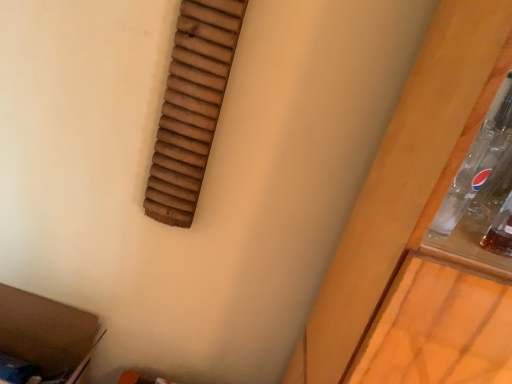
Where is `wooden slats at upper left`? This screenshot has height=384, width=512. wooden slats at upper left is located at coordinates (191, 106).

What do you see at coordinates (191, 106) in the screenshot?
I see `wooden slats at upper left` at bounding box center [191, 106].

Identify the location of brown cardboard at lower left. (46, 332).

The width and height of the screenshot is (512, 384). Describe the element at coordinates (46, 332) in the screenshot. I see `brown cardboard at lower left` at that location.

Where is `wooden slats at upper left`? wooden slats at upper left is located at coordinates (191, 106).

Considering the relative positions of wooden slats at upper left and brown cardboard at lower left in the image provided, is wooden slats at upper left to the right of brown cardboard at lower left from the viewer's perspective?

Correct, you'll find wooden slats at upper left to the right of brown cardboard at lower left.

Which object is more forward, wooden slats at upper left or brown cardboard at lower left?

wooden slats at upper left.

Is point (189, 213) farther from viewer compared to point (65, 323)?

No, it is in front of (65, 323).

From the image's perspective, which one is positioned lower, wooden slats at upper left or brown cardboard at lower left?

brown cardboard at lower left.

From a real-world perspective, which object stands above the other?

From a 3D spatial view, wooden slats at upper left is above.

Considering the sizes of objects wooden slats at upper left and brown cardboard at lower left in the image provided, who is thinner, wooden slats at upper left or brown cardboard at lower left?

With smaller width is wooden slats at upper left.

In terms of height, does wooden slats at upper left look taller or shorter compared to brown cardboard at lower left?

wooden slats at upper left is taller than brown cardboard at lower left.

Which of these two, wooden slats at upper left or brown cardboard at lower left, is bigger?

brown cardboard at lower left.

Choose the correct answer: Is wooden slats at upper left inside brown cardboard at lower left or outside it?

wooden slats at upper left cannot be found inside brown cardboard at lower left.

Is wooden slats at upper left in contact with brown cardboard at lower left?

There is a gap between wooden slats at upper left and brown cardboard at lower left.

Is wooden slats at upper left oriented towards brown cardboard at lower left?

No, wooden slats at upper left is not turned towards brown cardboard at lower left.

How many degrees apart are the facing directions of wooden slats at upper left and brown cardboard at lower left?

The facing directions of wooden slats at upper left and brown cardboard at lower left are 3.9 degrees apart.

Measure the distance from wooden slats at upper left to brown cardboard at lower left.

wooden slats at upper left and brown cardboard at lower left are 24.79 inches apart.

This screenshot has width=512, height=384. Find the location of `window that is above the brown cardboard at lower left (from a real-world perspective)`. window that is above the brown cardboard at lower left (from a real-world perspective) is located at coordinates click(191, 106).

In the image, is brown cardboard at lower left on the left side or the right side of wooden slats at upper left?

brown cardboard at lower left is to the left of wooden slats at upper left.

Considering their positions, is brown cardboard at lower left located in front of or behind wooden slats at upper left?

brown cardboard at lower left is behind wooden slats at upper left.

Which is less distant, (44, 337) or (186, 172)?

Point (44, 337) is farther from the camera than point (186, 172).

In the scene shown: From the image's perspective, is brown cardboard at lower left on wooden slats at upper left?

Incorrect, from the image's perspective, brown cardboard at lower left is lower than wooden slats at upper left.

From a real-world perspective, which is physically above, brown cardboard at lower left or wooden slats at upper left?

In real-world perspective, wooden slats at upper left is above.

Which of these two, brown cardboard at lower left or wooden slats at upper left, is wider?

brown cardboard at lower left is wider.

Is brown cardboard at lower left taller or shorter than wooden slats at upper left?

In the image, brown cardboard at lower left appears to be shorter than wooden slats at upper left.

Is brown cardboard at lower left smaller than wooden slats at upper left?

Incorrect, brown cardboard at lower left is not smaller in size than wooden slats at upper left.

Is wooden slats at upper left a part of brown cardboard at lower left?

No, wooden slats at upper left is not surrounded by brown cardboard at lower left.

Are brown cardboard at lower left and wooden slats at upper left located far from each other?

No.

Could you tell me if brown cardboard at lower left is turned towards wooden slats at upper left?

No, brown cardboard at lower left is not turned towards wooden slats at upper left.

Measure the distance between brown cardboard at lower left and wooden slats at upper left.

brown cardboard at lower left and wooden slats at upper left are 24.79 inches apart from each other.

What are the coordinates of `storage box that is under the wooden slats at upper left (from a real-world perspective)` in the screenshot? It's located at (46, 332).

Find the location of a particular element. window above the brown cardboard at lower left (from a real-world perspective) is located at coordinates (191, 106).

At what (x,y) coordinates should I click in order to perform the action: click on window in front of the brown cardboard at lower left. Please return your answer as a coordinate pair (x, y). The height and width of the screenshot is (384, 512). Looking at the image, I should click on (191, 106).